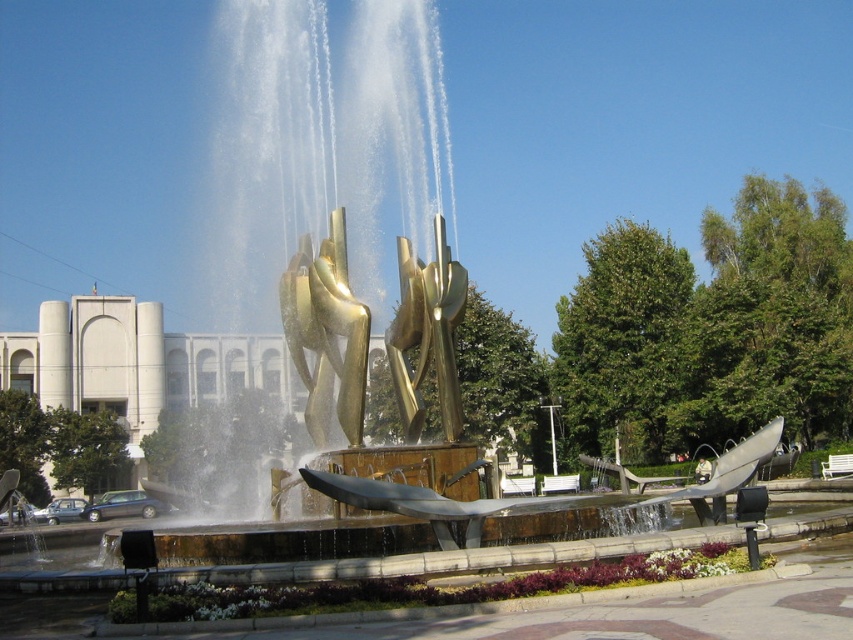
What do you see at coordinates (366, 227) in the screenshot?
I see `gold metallic water at center` at bounding box center [366, 227].

Does gold metallic water at center come behind gold polished sculpture at center?

No.

Where is `gold metallic water at center`? The image size is (853, 640). gold metallic water at center is located at coordinates (366, 227).

You are a GUI agent. You are given a task and a screenshot of the screen. Output one action in this format:
    pyautogui.click(x=<x>, y=<y>)
    Task: Click on the gold metallic water at center
    This screenshot has width=853, height=640.
    Given the screenshot: What is the action you would take?
    click(x=366, y=227)